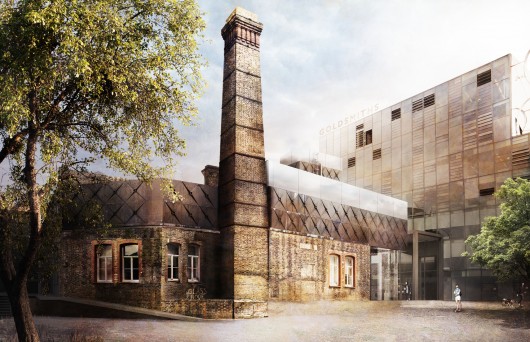
Locate an element on the screen. Image resolution: width=530 pixels, height=342 pixels. windows is located at coordinates (334, 275), (343, 272), (99, 261), (130, 259), (167, 260), (193, 259).